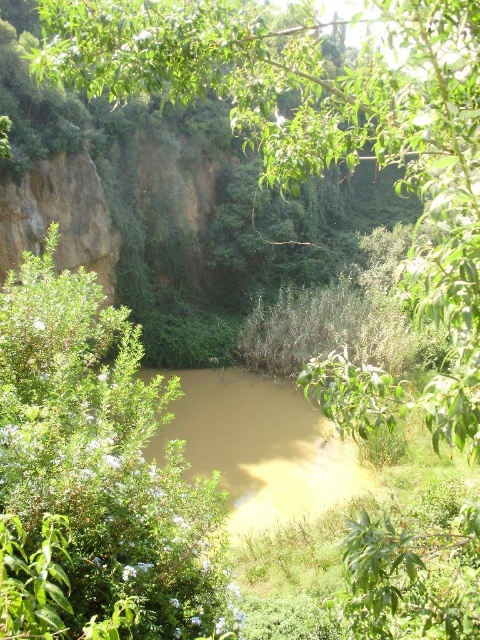
You are standing at point (324,141) in this natural setting. What object is located exactly at your current position?

The green leafy tree at center is located exactly at point (324,141).

You are a hiker who wants to cross the brown muddy water at center using the green leafy tree at center as a bridge. Can you safely walk across the tree to reach the other side?

The green leafy tree at center is 10.23 meters away from the brown muddy water at center, so the distance between them is too large for the tree to serve as a bridge. You cannot safely walk across the tree to reach the other side.

You are standing at the edge of the scene and want to cross the brown muddy water at center. There is a green leafy tree at center nearby. Which direction should you walk to reach the tree before crossing the water?

The green leafy tree at center is to the right of brown muddy water at center, so you should walk to the right to reach the tree before crossing the water.